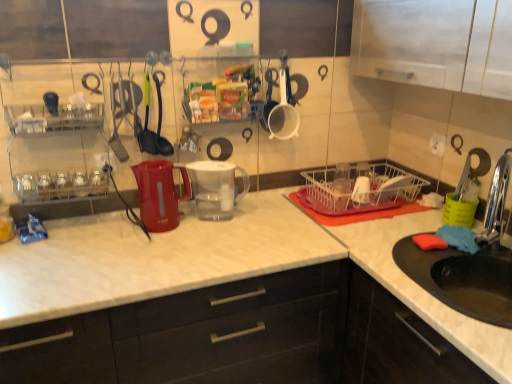
This screenshot has width=512, height=384. In order to click on free space in front of matte plastic kettle at center, the second appliance when ordered from right to left in this screenshot , I will do `click(156, 246)`.